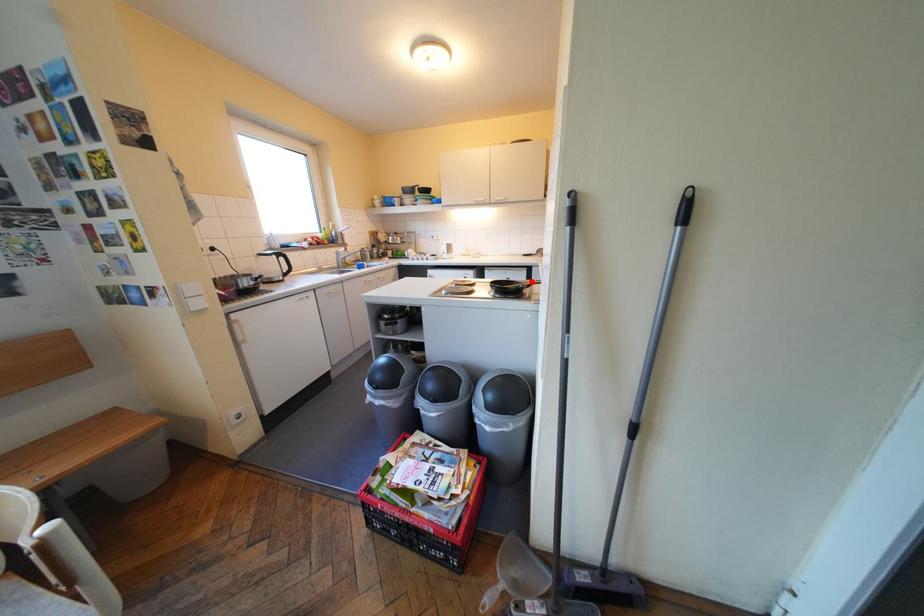
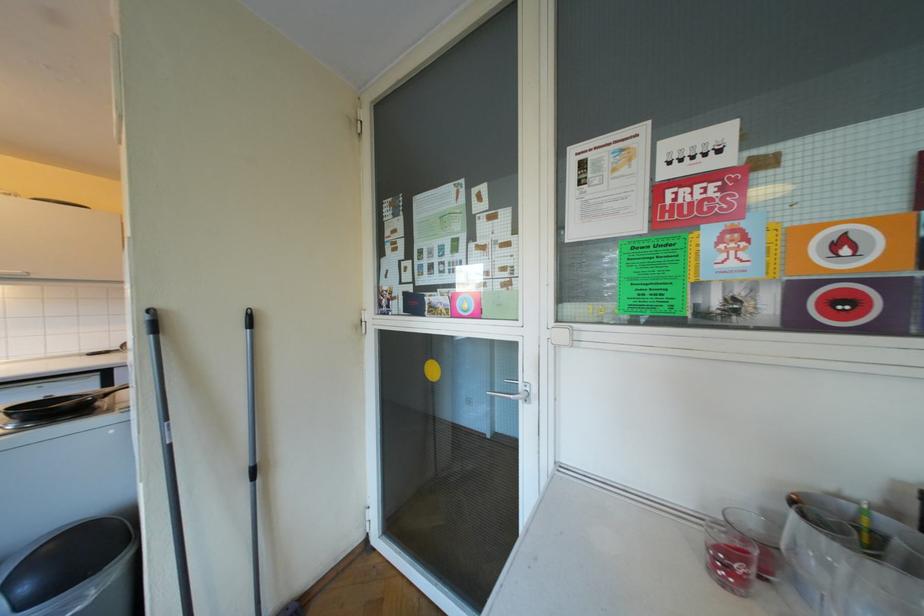
Question: I am providing you with two images of the same scene from different viewpoints. A red point is marked on the first image. At the location where the point appears in image 1, is it still visible in image 2?

Choices:
 (A) Yes
 (B) No

Answer: (A)